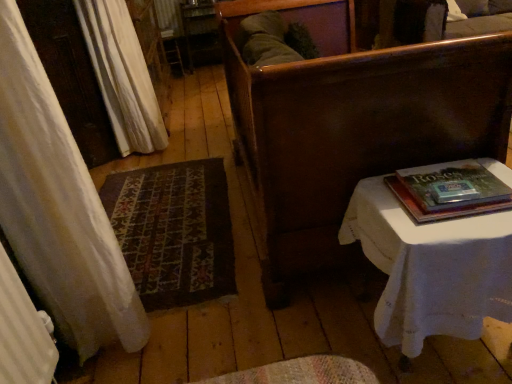
The height and width of the screenshot is (384, 512). I want to click on free space above white cloth-covered table at right (from a real-world perspective), so click(429, 217).